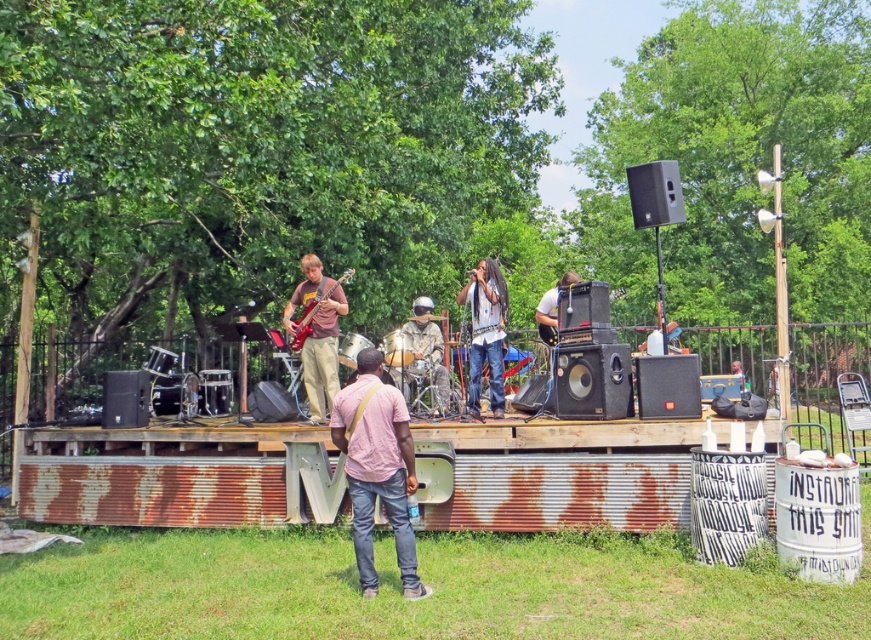
Question: Does pink cotton shirt at center appear on the right side of matte brown guitar at center?

Choices:
 (A) no
 (B) yes

Answer: (B)

Question: Based on their relative distances, which object is nearer to the matte brown guitar at center?

Choices:
 (A) matte black guitar at center
 (B) pink cotton shirt at center
 (C) camouflage fabric helmet at center

Answer: (C)

Question: Does matte brown guitar at center have a greater width compared to denim pants at center?

Choices:
 (A) no
 (B) yes

Answer: (B)

Question: Is denim pants at center wider than camouflage fabric helmet at center?

Choices:
 (A) no
 (B) yes

Answer: (A)

Question: Which point is farther to the camera?

Choices:
 (A) (490, 278)
 (B) (439, 412)

Answer: (B)

Question: Estimate the real-world distances between objects in this image. Which object is closer to the denim pants at center?

Choices:
 (A) glossy electric guitar at left
 (B) camouflage fabric helmet at center

Answer: (B)